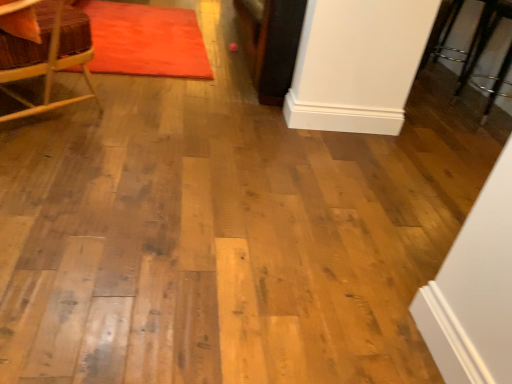
The height and width of the screenshot is (384, 512). What are the coordinates of `free location in front of velvet orange mat at upper left` in the screenshot? It's located at (167, 127).